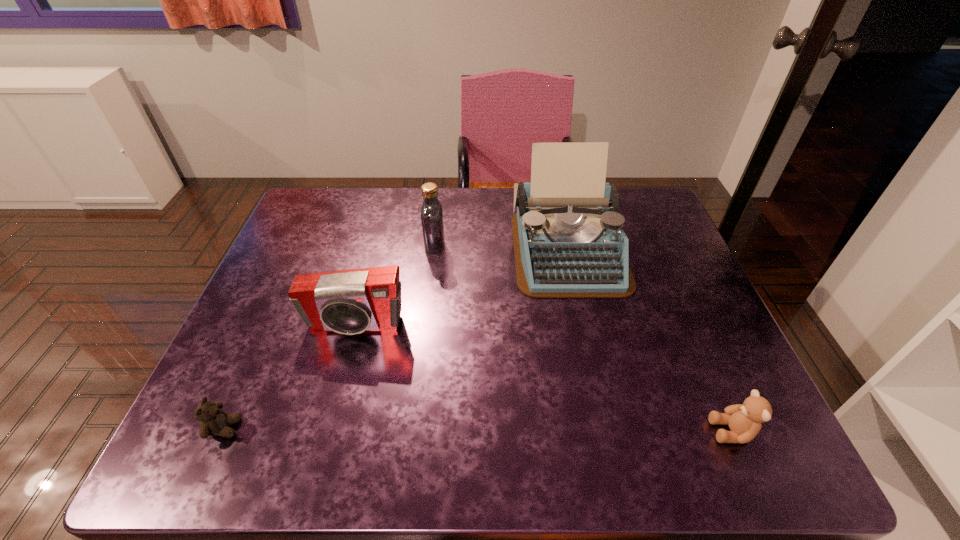
Where is `vacant area at the near left corner of the desktop`? vacant area at the near left corner of the desktop is located at coordinates (237, 456).

In the image, there is a desktop. At what (x,y) coordinates should I click in order to perform the action: click on vacant space at the far right corner. Please return your answer as a coordinate pair (x, y). Looking at the image, I should click on (645, 187).

Where is `unoccupied area between the shorter teddy bear and the right teddy bear`? unoccupied area between the shorter teddy bear and the right teddy bear is located at coordinates (478, 430).

The width and height of the screenshot is (960, 540). In order to click on vacant area between the tallest object and the right teddy bear in this screenshot , I will do `click(650, 341)`.

Find the location of `unoccupied position between the second object from right to left and the shorter teddy bear`. unoccupied position between the second object from right to left and the shorter teddy bear is located at coordinates (396, 339).

At what (x,y) coordinates should I click in order to perform the action: click on vacant area between the right teddy bear and the left teddy bear. Please return your answer as a coordinate pair (x, y). Image resolution: width=960 pixels, height=540 pixels. Looking at the image, I should click on (478, 430).

Image resolution: width=960 pixels, height=540 pixels. I want to click on vacant space that's between the left teddy bear and the second shortest object, so [478, 430].

Where is `blank region between the third object from right to left and the left teddy bear`? Image resolution: width=960 pixels, height=540 pixels. blank region between the third object from right to left and the left teddy bear is located at coordinates (329, 337).

Locate an element on the screen. The width and height of the screenshot is (960, 540). free space between the shortest object and the second tallest object is located at coordinates (329, 337).

Find the location of a particular element. empty location between the leftmost object and the camera is located at coordinates (290, 377).